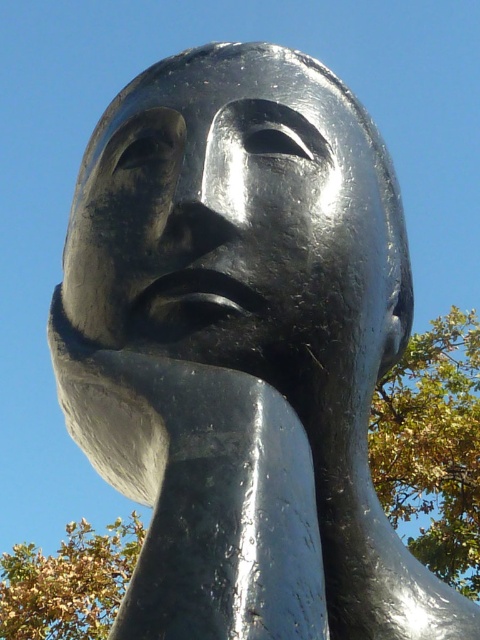
Is shiny black sculpture at center thinner than green leafy tree at lower left?

Yes.

Can you confirm if shiny black sculpture at center is positioned below green leafy tree at lower left?

No, shiny black sculpture at center is not below green leafy tree at lower left.

Image resolution: width=480 pixels, height=640 pixels. I want to click on shiny black sculpture at center, so click(x=240, y=218).

Is point (442, 332) less distant than point (33, 618)?

That is False.

Which is behind, point (442, 440) or point (4, 618)?

The point (442, 440) is more distant.

Does point (439, 317) come in front of point (128, 538)?

No, it is behind (128, 538).

The width and height of the screenshot is (480, 640). I want to click on green leafy tree at right, so click(x=433, y=445).

Between shiny black sculpture at center and green leafy tree at right, which one has less height?

shiny black sculpture at center is shorter.

Between shiny black sculpture at center and green leafy tree at right, which one has more height?

green leafy tree at right

Where is `shiny black sculpture at center`? This screenshot has width=480, height=640. shiny black sculpture at center is located at coordinates (240, 218).